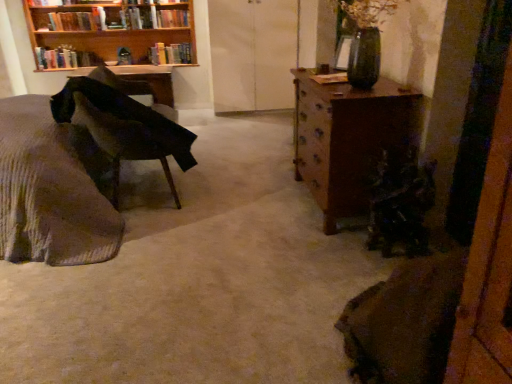
Where is `hardcover book at upper center, which is counted as the 1th book, starting from the right`? The width and height of the screenshot is (512, 384). hardcover book at upper center, which is counted as the 1th book, starting from the right is located at coordinates (170, 53).

The width and height of the screenshot is (512, 384). What do you see at coordinates (111, 31) in the screenshot? I see `wooden bookshelf at upper left` at bounding box center [111, 31].

In order to face hardcover books at upper left, acting as the 3th book starting from the right, should I rotate leftwards or rightwards?

You should look left and rotate roughly 23.610 degrees.

The image size is (512, 384). What do you see at coordinates (73, 21) in the screenshot? I see `hardcover book at upper left, which appears as the 2th book when viewed from the left` at bounding box center [73, 21].

Describe the element at coordinates (49, 193) in the screenshot. I see `woolen fabric bed at left` at that location.

What do you see at coordinates (349, 139) in the screenshot?
I see `brown wooden chest of drawers at right` at bounding box center [349, 139].

In order to click on hardcover book at upper center, which is counted as the 1th book, starting from the right in this screenshot , I will do `click(170, 53)`.

From a real-world perspective, is wooden bookshelf at upper left under brown wooden chest of drawers at right?

Incorrect, from a real-world perspective, wooden bookshelf at upper left is higher than brown wooden chest of drawers at right.

This screenshot has width=512, height=384. In order to click on chest of drawers in front of the wooden bookshelf at upper left in this screenshot , I will do `click(349, 139)`.

From the picture: From the image's perspective, is wooden bookshelf at upper left located above or below brown wooden chest of drawers at right?

Clearly, from the image's perspective, wooden bookshelf at upper left is above brown wooden chest of drawers at right.

Are wooden bookshelf at upper left and brown wooden chest of drawers at right beside each other?

No, wooden bookshelf at upper left is not next to brown wooden chest of drawers at right.

Is brown wooden chest of drawers at right facing towards hardcover book at upper left, the 2th book positioned from the right?

No.

Is brown wooden chest of drawers at right outside of hardcover book at upper left, the 2th book positioned from the right?

Yes, brown wooden chest of drawers at right is located beyond the bounds of hardcover book at upper left, the 2th book positioned from the right.

You are a GUI agent. You are given a task and a screenshot of the screen. Output one action in this format:
    pyautogui.click(x=<x>, y=<y>)
    Task: Click on the chest of drawers below the hardcover book at upper left, the 2th book positioned from the right (from the image's perspective)
    This screenshot has width=512, height=384.
    Given the screenshot: What is the action you would take?
    pyautogui.click(x=349, y=139)

Is there a large distance between hardcover book at upper center, which is the 3th book in left-to-right order, and velvet dark green chair at left?

That's right, there is a large distance between hardcover book at upper center, which is the 3th book in left-to-right order, and velvet dark green chair at left.

Locate an element on the screen. The image size is (512, 384). chair on the right of hardcover book at upper center, which is counted as the 1th book, starting from the right is located at coordinates [x=124, y=127].

From the image's perspective, is hardcover book at upper center, which is counted as the 1th book, starting from the right, above velvet dark green chair at left?

Yes, from the image's perspective, hardcover book at upper center, which is counted as the 1th book, starting from the right, is on top of velvet dark green chair at left.

Considering the relative positions of hardcover book at upper center, which is the 3th book in left-to-right order, and velvet dark green chair at left in the image provided, is hardcover book at upper center, which is the 3th book in left-to-right order, in front of velvet dark green chair at left?

No, hardcover book at upper center, which is the 3th book in left-to-right order, is further to the viewer.

Is hardcover book at upper left, the 2th book positioned from the right, behind velvet dark green chair at left?

Yes, hardcover book at upper left, the 2th book positioned from the right, is behind velvet dark green chair at left.

Does hardcover book at upper left, the 2th book positioned from the right, have a greater height compared to velvet dark green chair at left?

Incorrect, the height of hardcover book at upper left, the 2th book positioned from the right, is not larger of that of velvet dark green chair at left.

Which point is more distant from viewer, [50,22] or [126,153]?

The point [50,22] is behind.

Consider the image. From the image's perspective, is hardcover book at upper left, which appears as the 2th book when viewed from the left, located above velvet dark green chair at left?

Yes, from the image's perspective, hardcover book at upper left, which appears as the 2th book when viewed from the left, is on top of velvet dark green chair at left.

From a real-world perspective, is hardcover books at upper left, acting as the 3th book starting from the right, positioned over woolen fabric bed at left based on gravity?

Yes.

Does hardcover books at upper left, arranged as the first book when viewed from the left, turn towards woolen fabric bed at left?

Yes, hardcover books at upper left, arranged as the first book when viewed from the left, is facing woolen fabric bed at left.

Considering their positions, is hardcover books at upper left, acting as the 3th book starting from the right, located in front of or behind woolen fabric bed at left?

In the image, hardcover books at upper left, acting as the 3th book starting from the right, appears behind woolen fabric bed at left.

Is hardcover book at upper left, the 2th book positioned from the right, oriented towards wooden bookshelf at upper left?

Yes, hardcover book at upper left, the 2th book positioned from the right, is facing wooden bookshelf at upper left.

Can you tell me how much hardcover book at upper left, the 2th book positioned from the right, and wooden bookshelf at upper left differ in facing direction?

0.000247 degrees.

In the image, is hardcover book at upper left, the 2th book positioned from the right, positioned in front of or behind wooden bookshelf at upper left?

Clearly, hardcover book at upper left, the 2th book positioned from the right, is behind wooden bookshelf at upper left.

What are the coordinates of `the 2nd book counting from the left side of the wooden desk at left` in the screenshot? It's located at (65, 58).

Is wooden desk at left positioned with its back to hardcover books at upper left, acting as the 3th book starting from the right?

wooden desk at left does not have its back to hardcover books at upper left, acting as the 3th book starting from the right.

Is wooden desk at left far away from hardcover books at upper left, acting as the 3th book starting from the right?

No, there isn't a large distance between wooden desk at left and hardcover books at upper left, acting as the 3th book starting from the right.

Between point (94, 73) and point (61, 49), which one is positioned behind?

The point (61, 49) is more distant.

The height and width of the screenshot is (384, 512). What are the coordinates of `bookcase above the brown wooden chest of drawers at right (from the image's perspective)` in the screenshot? It's located at (111, 31).

You are a GUI agent. You are given a task and a screenshot of the screen. Output one action in this format:
    pyautogui.click(x=<x>, y=<y>)
    Task: Click on the chest of drawers below the hardcover book at upper left, the 2th book positioned from the right (from a real-world perspective)
    The width and height of the screenshot is (512, 384).
    Given the screenshot: What is the action you would take?
    pyautogui.click(x=349, y=139)

Based on their spatial positions, is wooden bookshelf at upper left or woolen fabric bed at left closer to hardcover books at upper left, arranged as the first book when viewed from the left?

wooden bookshelf at upper left is closer to hardcover books at upper left, arranged as the first book when viewed from the left.

Looking at the image, which one is located further to hardcover book at upper left, the 2th book positioned from the right, wooden desk at left or hardcover books at upper left, arranged as the first book when viewed from the left?

wooden desk at left lies further to hardcover book at upper left, the 2th book positioned from the right, than the other object.

From the image, which object appears to be farther from wooden desk at left, brown wooden chest of drawers at right or hardcover books at upper left, arranged as the first book when viewed from the left?

brown wooden chest of drawers at right lies further to wooden desk at left than the other object.

Estimate the real-world distances between objects in this image. Which object is further from hardcover books at upper left, arranged as the first book when viewed from the left, woolen fabric bed at left or brown wooden chest of drawers at right?

Based on the image, brown wooden chest of drawers at right appears to be further to hardcover books at upper left, arranged as the first book when viewed from the left.

When comparing their distances from hardcover books at upper left, acting as the 3th book starting from the right, does brown wooden chest of drawers at right or hardcover book at upper left, the 2th book positioned from the right, seem further?

brown wooden chest of drawers at right is positioned further to the anchor hardcover books at upper left, acting as the 3th book starting from the right.

Based on their spatial positions, is wooden desk at left or brown wooden chest of drawers at right closer to hardcover book at upper left, which appears as the 2th book when viewed from the left?

The object closer to hardcover book at upper left, which appears as the 2th book when viewed from the left, is wooden desk at left.

Looking at the image, which one is located further to hardcover book at upper center, which is the 3th book in left-to-right order, velvet dark green chair at left or wooden bookshelf at upper left?

Among the two, velvet dark green chair at left is located further to hardcover book at upper center, which is the 3th book in left-to-right order.

Based on their spatial positions, is hardcover book at upper left, which appears as the 2th book when viewed from the left, or wooden desk at left closer to woolen fabric bed at left?

Among the two, wooden desk at left is located nearer to woolen fabric bed at left.

Find the location of a particular element. chest of drawers between woolen fabric bed at left and hardcover books at upper left, arranged as the first book when viewed from the left, from front to back is located at coordinates (349, 139).

Identify the location of bookcase between hardcover book at upper left, which appears as the 2th book when viewed from the left, and hardcover book at upper center, which is counted as the 1th book, starting from the right, in the horizontal direction. Image resolution: width=512 pixels, height=384 pixels. (111, 31).

At what (x,y) coordinates should I click in order to perform the action: click on chair positioned between brown wooden chest of drawers at right and wooden bookshelf at upper left from near to far. Please return your answer as a coordinate pair (x, y). Image resolution: width=512 pixels, height=384 pixels. Looking at the image, I should click on (124, 127).

The height and width of the screenshot is (384, 512). I want to click on book between hardcover books at upper left, acting as the 3th book starting from the right, and wooden bookshelf at upper left, so click(x=73, y=21).